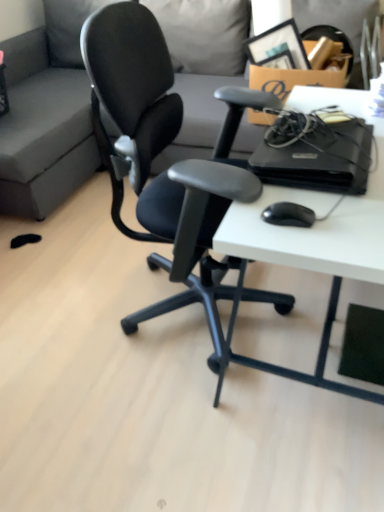
The image size is (384, 512). Find the location of `free spot to the left of black matte mouse at lower right`. free spot to the left of black matte mouse at lower right is located at coordinates (248, 222).